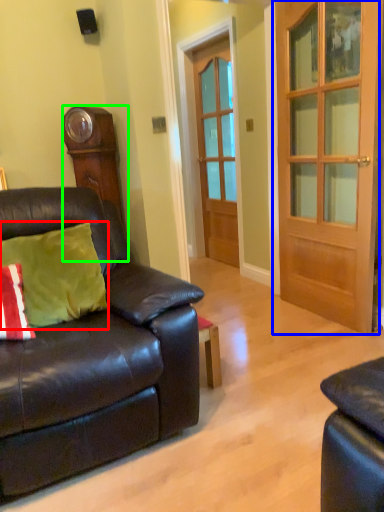
Question: Based on their relative distances, which object is nearer to pillow (highlighted by a red box)? Choose from door (highlighted by a blue box) and cabinetry (highlighted by a green box).

Choices:
 (A) door
 (B) cabinetry

Answer: (B)